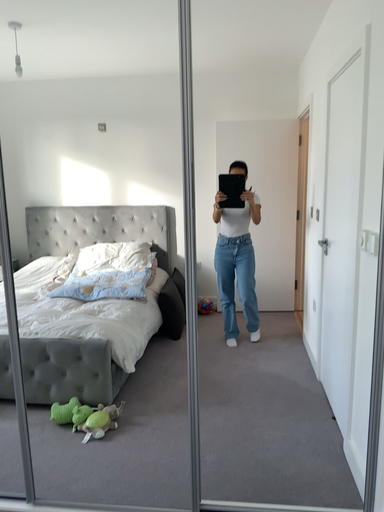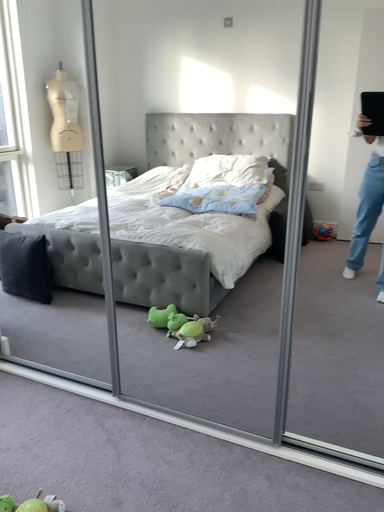
Question: How did the camera likely rotate when shooting the video?

Choices:
 (A) rotated upward
 (B) rotated downward

Answer: (B)